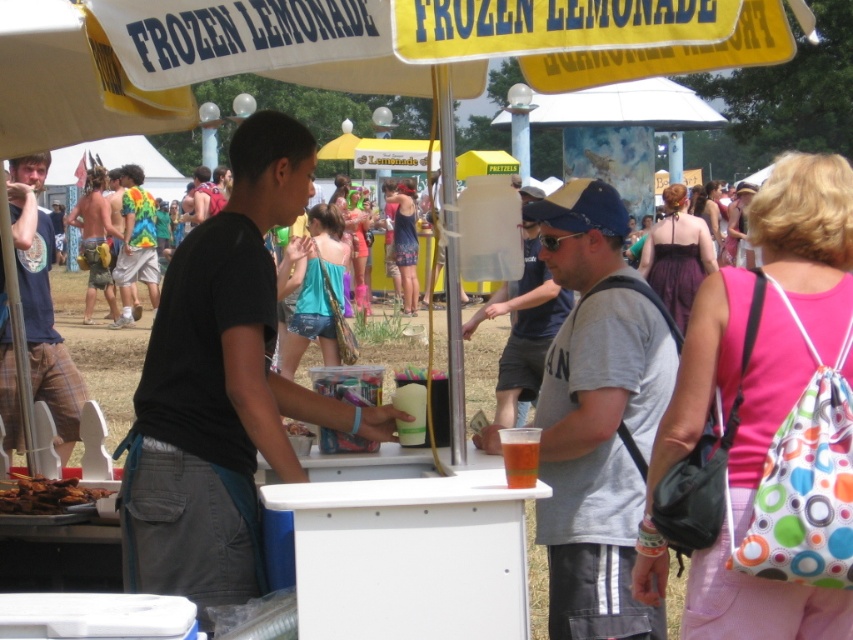
Question: Is black fabric apron at center positioned before tie-dye fabric shirt at left?

Choices:
 (A) no
 (B) yes

Answer: (B)

Question: Which point is closer to the camera?

Choices:
 (A) golden crispy chicken at lower left
 (B) gray cotton t-shirt at center
 (C) translucent plastic cup at lower center

Answer: (C)

Question: Does golden crispy chicken at lower left lie behind translucent plastic cup at lower center?

Choices:
 (A) no
 (B) yes

Answer: (B)

Question: Considering the real-world distances, which object is closest to the brushed metal t-shirt at left?

Choices:
 (A) gray cotton t-shirt at center
 (B) translucent plastic cup at lower center

Answer: (A)

Question: In this image, where is matte gray t-shirt at center located relative to translucent plastic cup at lower center?

Choices:
 (A) above
 (B) below

Answer: (A)

Question: Which object is farther from the camera taking this photo?

Choices:
 (A) matte gray t-shirt at center
 (B) translucent plastic cup at lower center
 (C) tie-dye fabric shirt at left

Answer: (C)